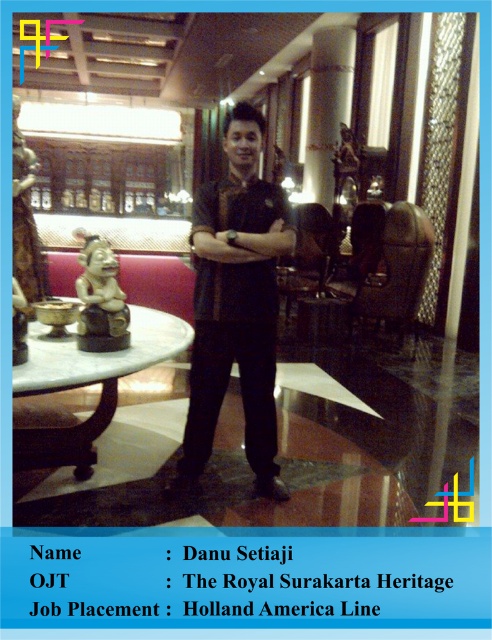
In the scene shown: You are a customer in the restaurant and want to locate the server. Where exactly is the matte black shirt at center positioned in the image?

The matte black shirt at center is positioned at point coordinates of 0.478 on the x axis and 0.480 on the y axis.

You are a guest at this establishment and want to place your coat on the nearest available surface. You see the matte black shirt at center and the white marble table at center. Which object can you place your coat on?

The white marble table at center is a suitable surface to place your coat, as the matte black shirt at center is part of a person and not a surface.

You are a guest in this formal setting and want to place your coat on the nearest surface. Which object, the matte black shirt at center or the white marble table at center, can you use to place your coat?

The white marble table at center is the appropriate surface for placing your coat since the matte black shirt at center is a person wearing the shirt and cannot be used as a surface.